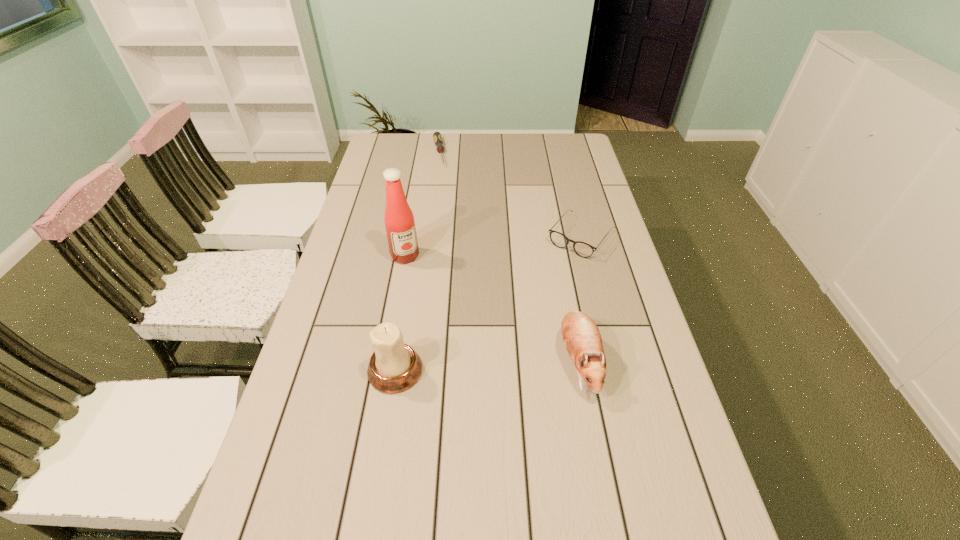
Image resolution: width=960 pixels, height=540 pixels. What are the coordinates of `candle holder` in the screenshot? It's located at (394, 367).

The image size is (960, 540). Identify the location of the third tallest object. (581, 336).

This screenshot has width=960, height=540. What are the coordinates of `the tallest object` in the screenshot? It's located at (399, 221).

Where is `spectacles`? The width and height of the screenshot is (960, 540). spectacles is located at coordinates (582, 249).

You are a GUI agent. You are given a task and a screenshot of the screen. Output one action in this format:
    pyautogui.click(x=<x>, y=<y>)
    Task: Click on the screwdriver
    
    Given the screenshot: What is the action you would take?
    pyautogui.click(x=437, y=136)

Locate an element on the screen. The width and height of the screenshot is (960, 540). the shortest object is located at coordinates (437, 136).

At what (x,y) coordinates should I click in order to perform the action: click on blank space located on the back of the fourth shortest object. Please return your answer as a coordinate pair (x, y). The width and height of the screenshot is (960, 540). Looking at the image, I should click on (406, 301).

Where is `free space located 0.070m at the face of the hamster`? Image resolution: width=960 pixels, height=540 pixels. free space located 0.070m at the face of the hamster is located at coordinates (591, 433).

Locate an element on the screen. This screenshot has width=960, height=540. vacant space located on the front-facing side of the tallest object is located at coordinates (436, 314).

The height and width of the screenshot is (540, 960). I want to click on free location located 0.050m on the front-facing side of the tallest object, so click(415, 275).